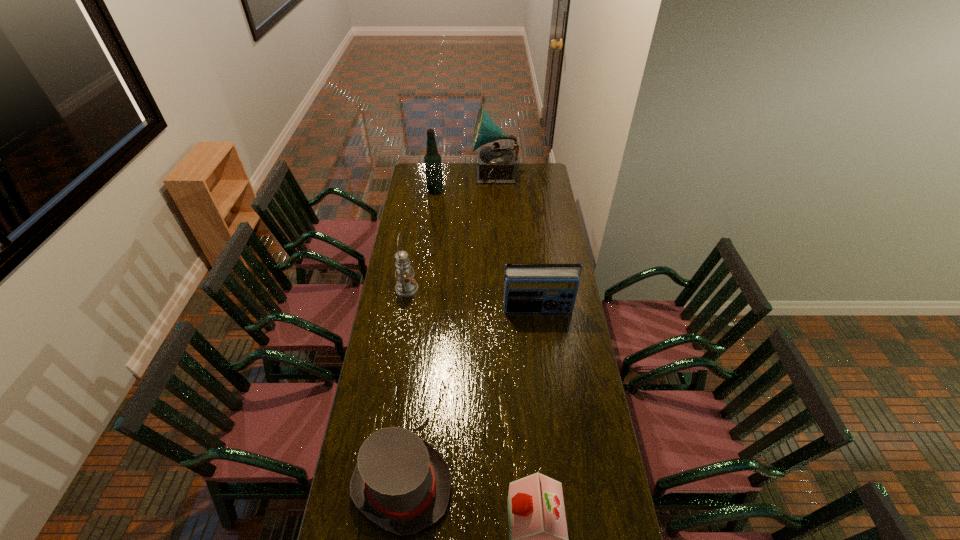
Where is `record player`? The height and width of the screenshot is (540, 960). record player is located at coordinates (496, 163).

What are the coordinates of `alcohol` in the screenshot? It's located at (433, 165).

You are a GUI agent. You are given a task and a screenshot of the screen. Output one action in this format:
    pyautogui.click(x=<x>, y=<y>)
    Task: Click on the fourth shortest object
    This screenshot has width=960, height=540.
    Given the screenshot: What is the action you would take?
    pyautogui.click(x=406, y=286)

Identify the location of the fourth nearest object. (406, 286).

Where is `radio receiver`? radio receiver is located at coordinates (526, 290).

Locate an element on the screen. Image resolution: width=960 pixels, height=540 pixels. dress hat is located at coordinates (401, 483).

You are a GUI agent. You are given a task and a screenshot of the screen. Output one action in this format:
    pyautogui.click(x=<x>, y=<y>)
    Task: Click on the vacant space located on the horn of the record player
    The width and height of the screenshot is (960, 540).
    Given the screenshot: What is the action you would take?
    pyautogui.click(x=448, y=176)

This screenshot has width=960, height=540. I want to click on free region located on the horn of the record player, so click(x=454, y=176).

Find the location of a particular element. The image size is (960, 540). free point located 0.320m on the horn of the record player is located at coordinates (421, 176).

Identify the location of free space located 0.130m on the back of the alcohol. (438, 176).